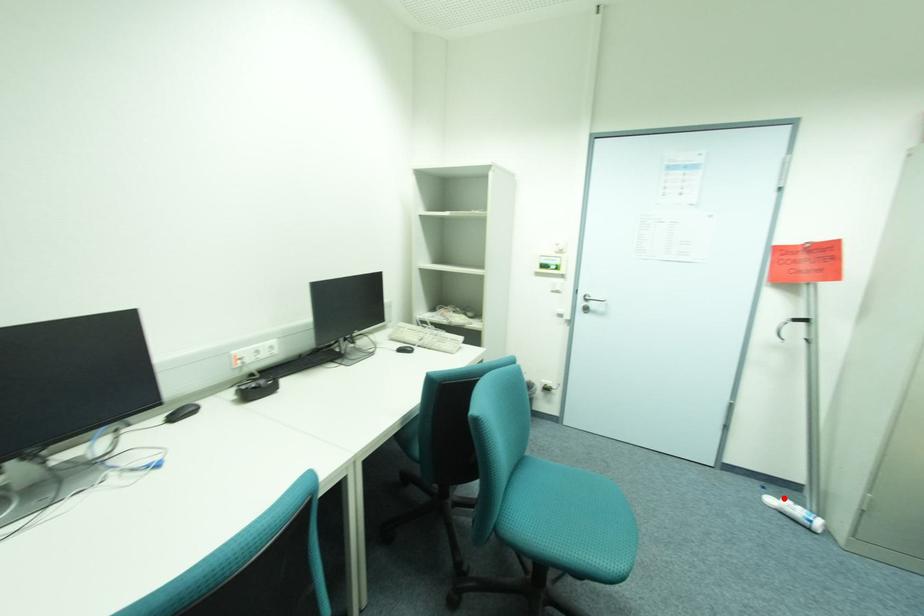
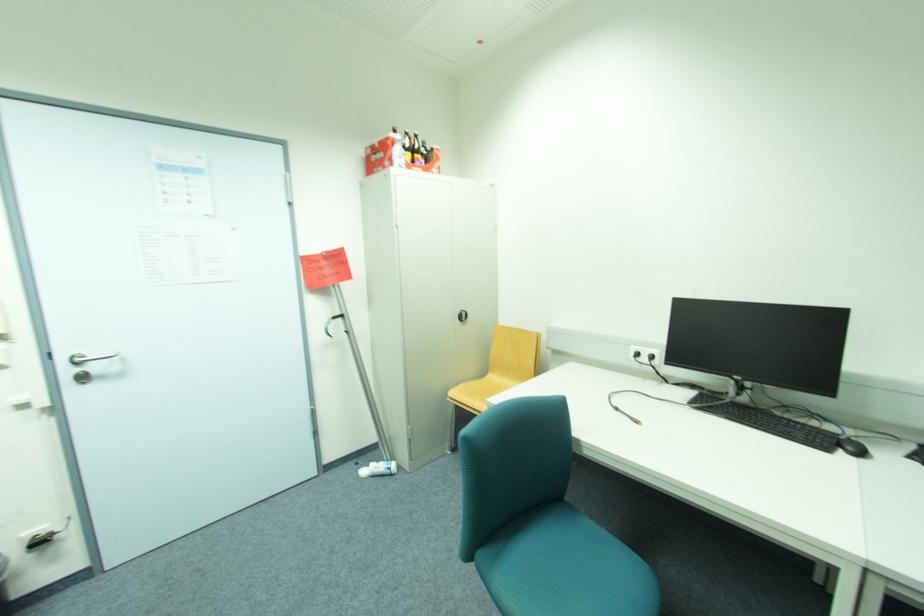
The point at the highlighted location is marked in the first image. Where is the corresponding point in the second image?

(373, 468)